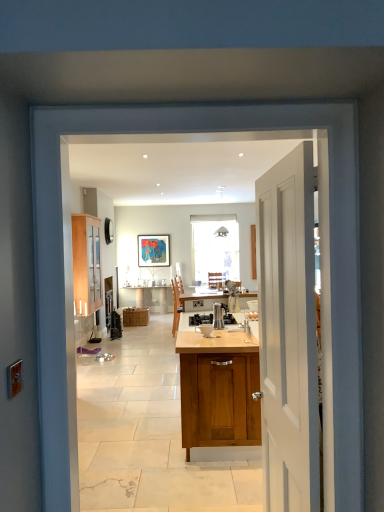
The height and width of the screenshot is (512, 384). Describe the element at coordinates (200, 319) in the screenshot. I see `metallic stainless steel coffee maker at center` at that location.

Where is `metallic stainless steel coffee maker at center`? The image size is (384, 512). metallic stainless steel coffee maker at center is located at coordinates (200, 319).

Is wooden cabinet at left, which appears as the 1th cabinetry when viewed from the left, positioned far away from metallic stainless steel coffee maker at center?

wooden cabinet at left, which appears as the 1th cabinetry when viewed from the left, is positioned a significant distance from metallic stainless steel coffee maker at center.

Considering the relative positions of wooden cabinet at left, which appears as the 1th cabinetry when viewed from the left, and metallic stainless steel coffee maker at center in the image provided, is wooden cabinet at left, which appears as the 1th cabinetry when viewed from the left, to the right of metallic stainless steel coffee maker at center from the viewer's perspective?

No, wooden cabinet at left, which appears as the 1th cabinetry when viewed from the left, is not to the right of metallic stainless steel coffee maker at center.

Does wooden cabinet at left, marked as the second cabinetry in a back-to-front arrangement, have a greater width compared to metallic stainless steel coffee maker at center?

No.

From the image's perspective, is wooden cabinet at left, placed as the second cabinetry when sorted from bottom to top, over metallic stainless steel coffee maker at center?

Yes, from the image's perspective, wooden cabinet at left, placed as the second cabinetry when sorted from bottom to top, is over metallic stainless steel coffee maker at center.

Considering the sizes of objects woven wicker basket at center, placed as the first cabinetry when sorted from bottom to top, and metallic stainless steel coffee maker at center in the image provided, who is wider, woven wicker basket at center, placed as the first cabinetry when sorted from bottom to top, or metallic stainless steel coffee maker at center?

woven wicker basket at center, placed as the first cabinetry when sorted from bottom to top.

Can you confirm if woven wicker basket at center, which is the 2th cabinetry from left to right, is taller than metallic stainless steel coffee maker at center?

Yes, woven wicker basket at center, which is the 2th cabinetry from left to right, is taller than metallic stainless steel coffee maker at center.

From a real-world perspective, does woven wicker basket at center, which appears as the first cabinetry when viewed from the right, sit lower than metallic stainless steel coffee maker at center?

Yes.

From the image's perspective, relative to metallic stainless steel coffee maker at center, is woven wicker basket at center, the 2th cabinetry in the top-to-bottom sequence, above or below?

Clearly, from the image's perspective, woven wicker basket at center, the 2th cabinetry in the top-to-bottom sequence, is below metallic stainless steel coffee maker at center.

From a real-world perspective, between metallic stainless steel coffee maker at center and satin silver coffee maker at center, who is vertically higher?

satin silver coffee maker at center is physically above.

Is metallic stainless steel coffee maker at center not inside satin silver coffee maker at center?

metallic stainless steel coffee maker at center is positioned outside satin silver coffee maker at center.

Which of these two, metallic stainless steel coffee maker at center or satin silver coffee maker at center, stands shorter?

metallic stainless steel coffee maker at center is shorter.

At what (x,y) coordinates should I click in order to perform the action: click on appliance on the left of satin silver coffee maker at center. Please return your answer as a coordinate pair (x, y). The width and height of the screenshot is (384, 512). Looking at the image, I should click on (200, 319).

This screenshot has width=384, height=512. I want to click on cabinetry located above the woven wicker basket at center, which appears as the 2th cabinetry when viewed from the front (from a real-world perspective), so click(x=86, y=264).

Which object is closer to the camera taking this photo, wooden cabinet at left, which ranks as the 1th cabinetry in front-to-back order, or woven wicker basket at center, which appears as the first cabinetry when viewed from the right?

wooden cabinet at left, which ranks as the 1th cabinetry in front-to-back order, is closer to the camera.

Does wooden cabinet at left, which appears as the first cabinetry when viewed from the top, have a lesser height compared to woven wicker basket at center, acting as the 1th cabinetry starting from the back?

In fact, wooden cabinet at left, which appears as the first cabinetry when viewed from the top, may be taller than woven wicker basket at center, acting as the 1th cabinetry starting from the back.

From a real-world perspective, between wooden cabinet at left, which ranks as the 1th cabinetry in front-to-back order, and woven wicker basket at center, which appears as the 2th cabinetry when viewed from the front, who is vertically lower?

woven wicker basket at center, which appears as the 2th cabinetry when viewed from the front.

Can you tell me how much metallic stainless steel coffee maker at center and white painted wood door at right differ in facing direction?

They differ by 3.03 degrees in their facing directions.

From a real-world perspective, between metallic stainless steel coffee maker at center and white painted wood door at right, who is vertically higher?

white painted wood door at right is physically above.

Is white painted wood door at right at the back of metallic stainless steel coffee maker at center?

No, white painted wood door at right is not at the back of metallic stainless steel coffee maker at center.

Looking at this image, how much distance is there between metallic stainless steel coffee maker at center and white painted wood door at right?

metallic stainless steel coffee maker at center and white painted wood door at right are 2.37 meters apart from each other.

Is wooden cabinet at left, which appears as the first cabinetry when viewed from the top, inside the boundaries of white painted wood door at right, or outside?

wooden cabinet at left, which appears as the first cabinetry when viewed from the top, is spatially situated outside white painted wood door at right.

Who is shorter, wooden cabinet at left, which is the 2th cabinetry in right-to-left order, or white painted wood door at right?

wooden cabinet at left, which is the 2th cabinetry in right-to-left order, is shorter.

Does wooden cabinet at left, marked as the second cabinetry in a back-to-front arrangement, appear on the right side of white painted wood door at right?

No.

Locate an element on the screen. door on the right of wooden cabinet at left, which is the 2th cabinetry in right-to-left order is located at coordinates (288, 333).

Is white painted wood door at right at the back of woven wicker basket at center, which appears as the first cabinetry when viewed from the right?

No, woven wicker basket at center, which appears as the first cabinetry when viewed from the right,'s orientation is not away from white painted wood door at right.

Which of these two, woven wicker basket at center, which is the 2th cabinetry from left to right, or white painted wood door at right, stands shorter?

Standing shorter between the two is woven wicker basket at center, which is the 2th cabinetry from left to right.

Does woven wicker basket at center, which appears as the 2th cabinetry when viewed from the front, have a smaller size compared to white painted wood door at right?

Indeed, woven wicker basket at center, which appears as the 2th cabinetry when viewed from the front, has a smaller size compared to white painted wood door at right.

Looking at this image, is woven wicker basket at center, the 2th cabinetry in the top-to-bottom sequence, next to white painted wood door at right and touching it?

No.

The width and height of the screenshot is (384, 512). I want to click on cabinetry that is the 2nd one when counting leftward from the metallic stainless steel coffee maker at center, so click(x=86, y=264).

Locate an element on the screen. The height and width of the screenshot is (512, 384). appliance in front of the woven wicker basket at center, which appears as the 2th cabinetry when viewed from the front is located at coordinates (200, 319).

Based on their spatial positions, is white painted wood door at right or wooden cabinet at left, which ranks as the 1th cabinetry in front-to-back order, closer to woven wicker basket at center, which appears as the 2th cabinetry when viewed from the front?

The object closer to woven wicker basket at center, which appears as the 2th cabinetry when viewed from the front, is wooden cabinet at left, which ranks as the 1th cabinetry in front-to-back order.

When comparing their distances from white painted wood door at right, does woven wicker basket at center, which is the 2th cabinetry from left to right, or wooden cabinet at left, placed as the second cabinetry when sorted from bottom to top, seem closer?

Based on the image, wooden cabinet at left, placed as the second cabinetry when sorted from bottom to top, appears to be nearer to white painted wood door at right.

From the image, which object appears to be nearer to metallic stainless steel coffee maker at center, woven wicker basket at center, which appears as the 2th cabinetry when viewed from the front, or satin silver coffee maker at center?

Based on the image, satin silver coffee maker at center appears to be nearer to metallic stainless steel coffee maker at center.

Estimate the real-world distances between objects in this image. Which object is further from metallic stainless steel coffee maker at center, white painted wood door at right or wooden cabinet at left, which ranks as the 1th cabinetry in front-to-back order?

The object further to metallic stainless steel coffee maker at center is wooden cabinet at left, which ranks as the 1th cabinetry in front-to-back order.

From the image, which object appears to be nearer to woven wicker basket at center, placed as the first cabinetry when sorted from bottom to top, white painted wood door at right or satin silver coffee maker at center?

The object closer to woven wicker basket at center, placed as the first cabinetry when sorted from bottom to top, is satin silver coffee maker at center.

Considering their positions, is metallic stainless steel coffee maker at center positioned further to wooden cabinet at left, which ranks as the 1th cabinetry in front-to-back order, than satin silver coffee maker at center?

The object further to wooden cabinet at left, which ranks as the 1th cabinetry in front-to-back order, is metallic stainless steel coffee maker at center.

Considering their positions, is woven wicker basket at center, the 2th cabinetry in the top-to-bottom sequence, positioned closer to satin silver coffee maker at center than white painted wood door at right?

white painted wood door at right is positioned closer to the anchor satin silver coffee maker at center.

Considering their positions, is satin silver coffee maker at center positioned further to metallic stainless steel coffee maker at center than wooden cabinet at left, which is the 2th cabinetry in right-to-left order?

Among the two, wooden cabinet at left, which is the 2th cabinetry in right-to-left order, is located further to metallic stainless steel coffee maker at center.

Find the location of a particular element. cabinetry between white painted wood door at right and woven wicker basket at center, the 2th cabinetry in the top-to-bottom sequence, from front to back is located at coordinates (86, 264).

What are the coordinates of `kitchen appliance located between white painted wood door at right and wooden cabinet at left, placed as the second cabinetry when sorted from bottom to top, in the depth direction` in the screenshot? It's located at (218, 316).

Locate an element on the screen. This screenshot has height=512, width=384. cabinetry between satin silver coffee maker at center and woven wicker basket at center, which appears as the 2th cabinetry when viewed from the front, along the z-axis is located at coordinates (86, 264).

Where is `appliance between white painted wood door at right and wooden cabinet at left, which ranks as the 1th cabinetry in front-to-back order, along the z-axis`? The image size is (384, 512). appliance between white painted wood door at right and wooden cabinet at left, which ranks as the 1th cabinetry in front-to-back order, along the z-axis is located at coordinates (200, 319).